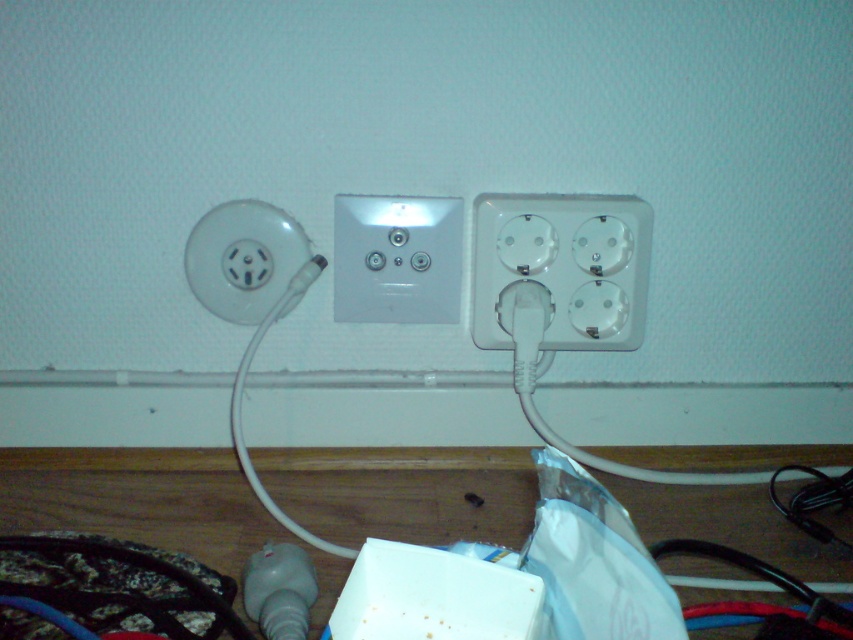
Question: Considering the real-world distances, which object is farthest from the white plastic socket at center right?

Choices:
 (A) white plastic socket at center
 (B) white plastic socket at left

Answer: (B)

Question: Does white plastic socket at center right have a greater width compared to white plastic socket at left?

Choices:
 (A) no
 (B) yes

Answer: (B)

Question: Where is white plastic socket at center located in relation to white plastic socket at left in the image?

Choices:
 (A) below
 (B) above

Answer: (B)

Question: Estimate the real-world distances between objects in this image. Which object is closer to the white plastic socket at center?

Choices:
 (A) white plastic socket at left
 (B) white plastic socket at center right

Answer: (A)

Question: Is white plastic socket at center below white plastic socket at left?

Choices:
 (A) no
 (B) yes

Answer: (A)

Question: Which point is farther to the camera?

Choices:
 (A) white plastic socket at left
 (B) white plastic socket at center
 (C) white plastic socket at center right

Answer: (B)